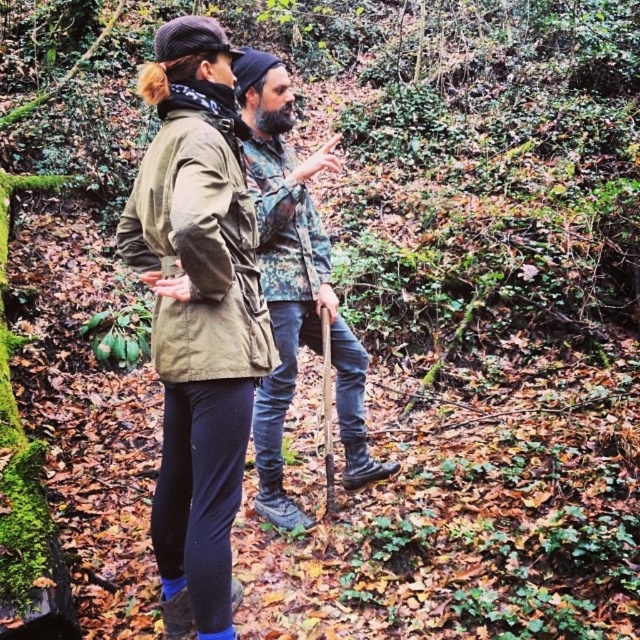
You are a hiker trying to decide which clothing item to choose for visibility in the forest. The scene shows two people wearing the matte khaki jacket at center and the camouflage fabric shirt at center. Which item is shorter in length and might be less visible from a distance?

The matte khaki jacket at center is shorter than the camouflage fabric shirt at center, so it might be less visible from a distance due to its shorter length.

Looking at this image, based on the scene description, where is the matte khaki jacket at center located in the image?

The matte khaki jacket at center is located at the 2D coordinates point (196, 316).